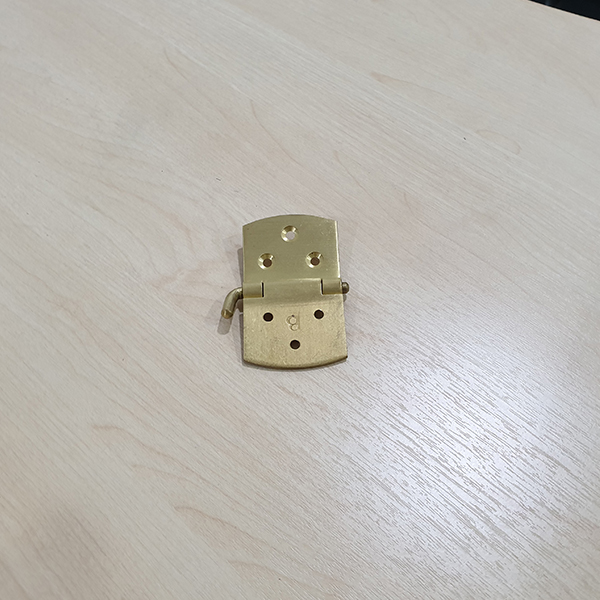
Locate an element on the screen. This screenshot has height=600, width=600. bottom part of hinge is located at coordinates point(269,332).